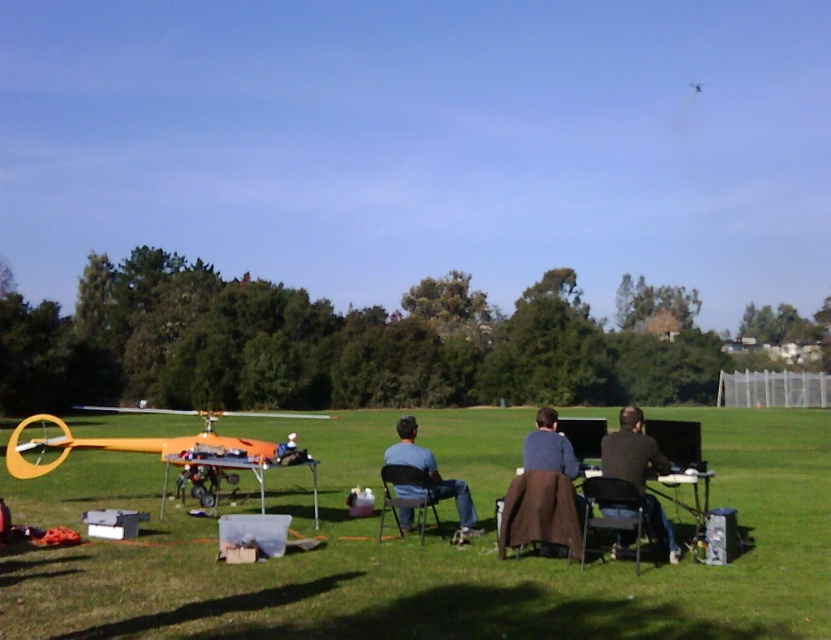
You are standing at the center of the field and see the point marked at coordinates (165, 448). What object is located at that point?

The point at coordinates (165, 448) marks the location of the orange matte helicopter at lower left.

You are planning to set up a tent in the grassy field and need to ensure there is enough space between the orange matte helicopter at lower left and the black plastic chair at lower right. Based on their sizes, which object should you place closer to the tent to avoid blocking the entrance?

The black plastic chair at lower right is shorter than the orange matte helicopter at lower left. To avoid blocking the entrance, place the taller orange matte helicopter at lower left farther away from the tent and keep the shorter black plastic chair at lower right closer to ensure it doesn